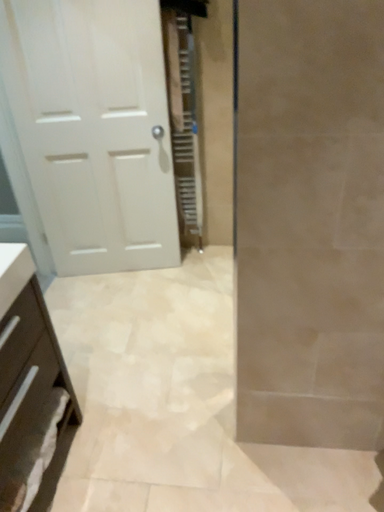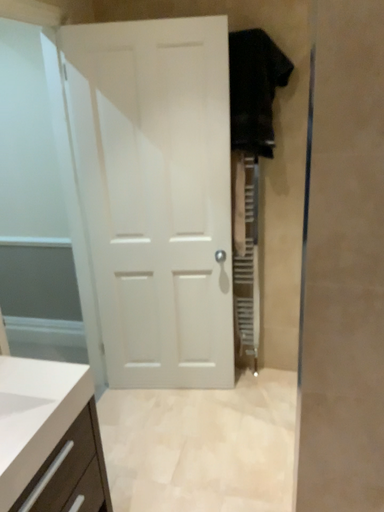
Question: Which way did the camera rotate in the video?

Choices:
 (A) rotated upward
 (B) rotated downward

Answer: (A)